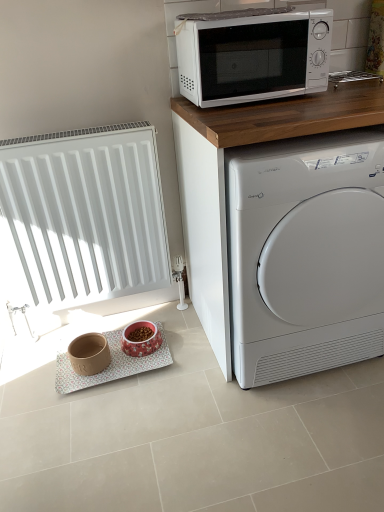
This screenshot has width=384, height=512. I want to click on free space in front of matte brown bowl at lower left, marked as the 2th appliance in a right-to-left arrangement, so click(x=87, y=386).